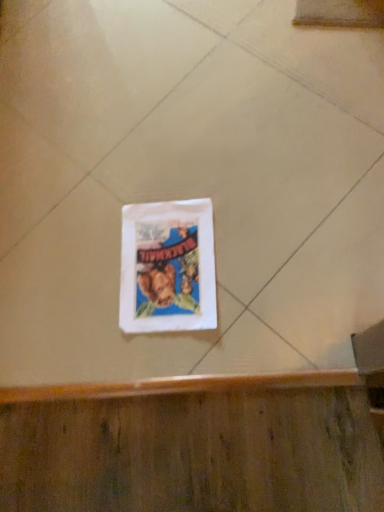
Where is `vacant space situated on the left part of white paper bag at center`? The height and width of the screenshot is (512, 384). vacant space situated on the left part of white paper bag at center is located at coordinates (74, 298).